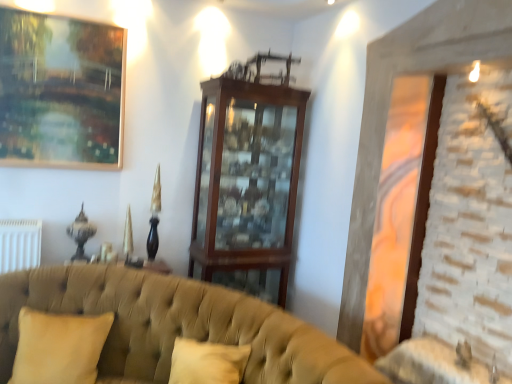
Question: From a real-world perspective, is gold-framed painting at upper left on top of beige fabric pillow at lower left?

Choices:
 (A) yes
 (B) no

Answer: (A)

Question: Could you tell me if gold-framed painting at upper left is facing beige fabric pillow at lower left?

Choices:
 (A) yes
 (B) no

Answer: (B)

Question: Can you confirm if gold-framed painting at upper left is positioned to the right of beige fabric pillow at lower left?

Choices:
 (A) no
 (B) yes

Answer: (A)

Question: Does gold-framed painting at upper left lie behind beige fabric pillow at lower left?

Choices:
 (A) yes
 (B) no

Answer: (A)

Question: Does gold-framed painting at upper left have a smaller size compared to beige fabric pillow at lower left?

Choices:
 (A) yes
 (B) no

Answer: (A)

Question: Is gold-framed painting at upper left inside or outside of wooden cabinet at center?

Choices:
 (A) outside
 (B) inside

Answer: (A)

Question: In terms of width, does gold-framed painting at upper left look wider or thinner when compared to wooden cabinet at center?

Choices:
 (A) wide
 (B) thin

Answer: (B)

Question: Is point (57, 157) closer or farther from the camera than point (221, 157)?

Choices:
 (A) farther
 (B) closer

Answer: (B)

Question: From the image's perspective, relative to wooden cabinet at center, is gold-framed painting at upper left above or below?

Choices:
 (A) above
 (B) below

Answer: (A)

Question: Based on their sizes in the image, would you say beige fabric pillow at lower left is bigger or smaller than wooden cabinet at center?

Choices:
 (A) small
 (B) big

Answer: (A)

Question: Which is correct: beige fabric pillow at lower left is inside wooden cabinet at center, or outside of it?

Choices:
 (A) inside
 (B) outside

Answer: (B)

Question: From a real-world perspective, relative to wooden cabinet at center, is beige fabric pillow at lower left vertically above or below?

Choices:
 (A) below
 (B) above

Answer: (A)

Question: From the image's perspective, is beige fabric pillow at lower left located above or below wooden cabinet at center?

Choices:
 (A) below
 (B) above

Answer: (A)

Question: From the image's perspective, is gold-framed painting at upper left above or below tufted fabric couch at lower left?

Choices:
 (A) above
 (B) below

Answer: (A)

Question: Is point (1, 14) closer or farther from the camera than point (286, 379)?

Choices:
 (A) farther
 (B) closer

Answer: (A)